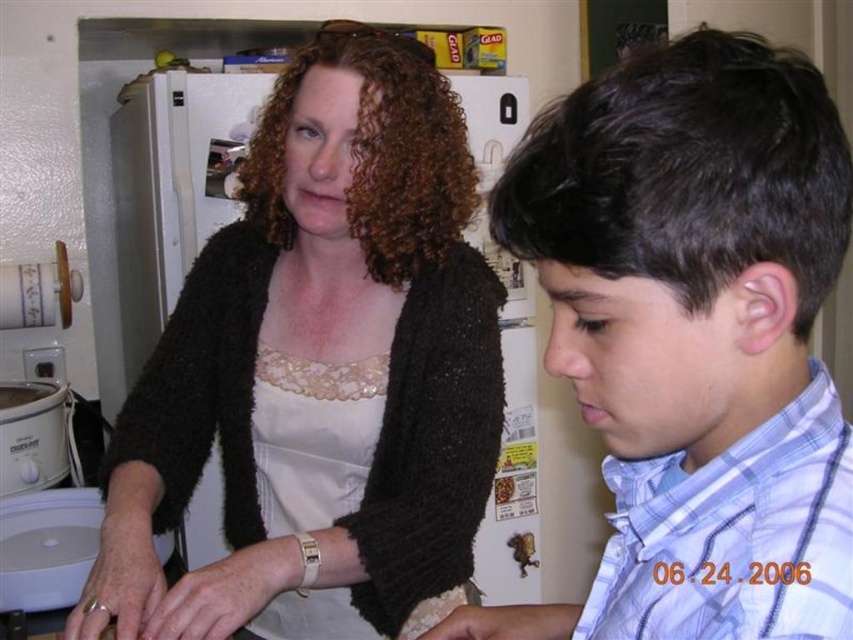
You are standing in the kitchen and want to hand a recipe card to both the person wearing the black fuzzy sweater at upper left and the person in the blue plaid shirt at center. Which person should you approach first based on their proximity to you?

You should approach the person wearing the black fuzzy sweater at upper left first because they are closer to you compared to the blue plaid shirt at center.

You are organizing a clothing donation drive and need to determine which item takes up more vertical space when hanging. Based on the scene, which item is taller between the black fuzzy sweater at upper left and the blue plaid shirt at center?

The black fuzzy sweater at upper left is taller than the blue plaid shirt at center, so it takes up more vertical space when hanging.